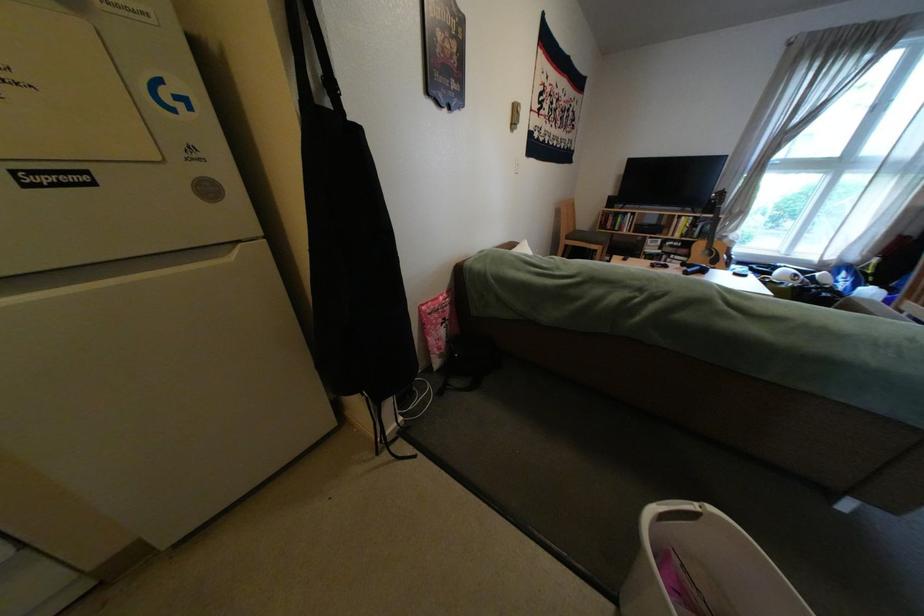
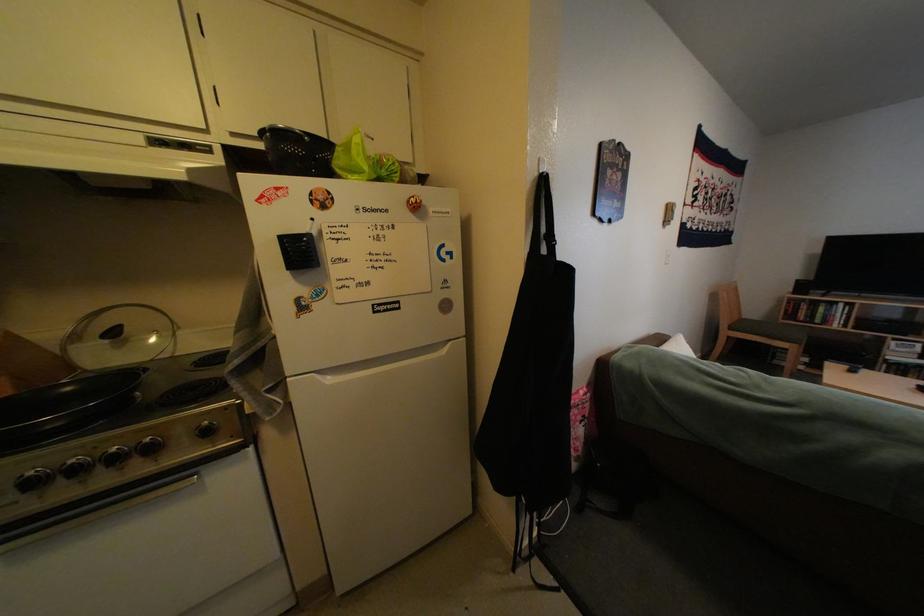
From the picture: The images are taken continuously from a first-person perspective. In which direction are you moving?

The movement direction of the cameraman is left, backward.